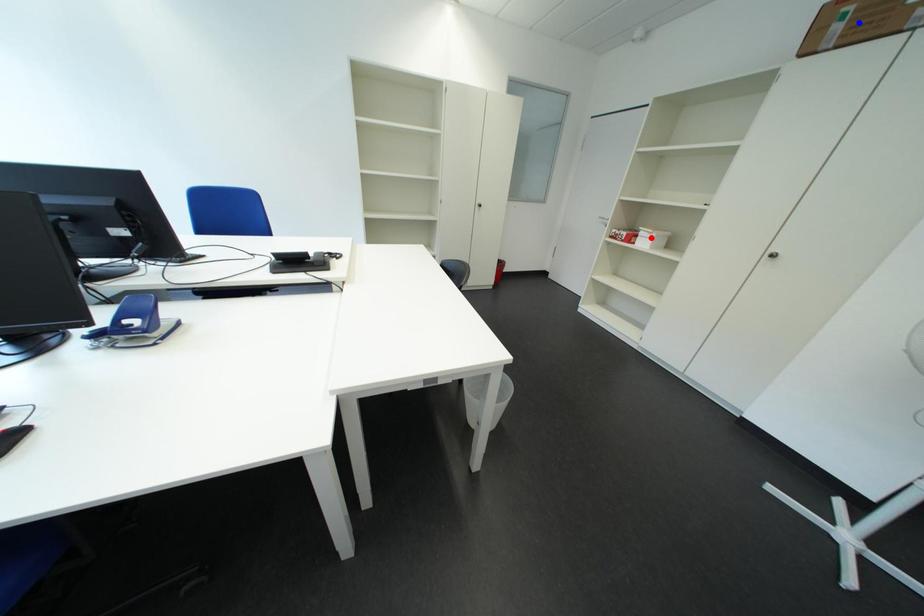
Question: Two points are marked on the image. Which point is closer to the camera?

Choices:
 (A) Blue point is closer.
 (B) Red point is closer.

Answer: (A)